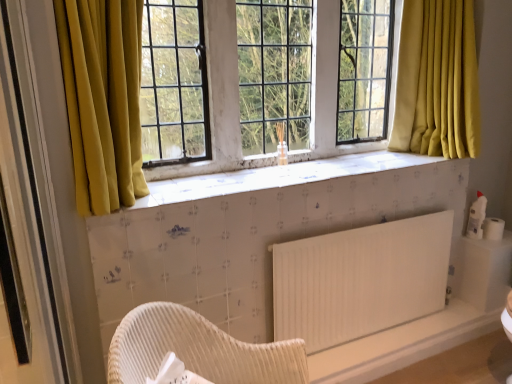
Question: Does white matte toilet paper at right contain white matte radiator at lower right?

Choices:
 (A) yes
 (B) no

Answer: (B)

Question: Does white matte toilet paper at right have a greater height compared to white matte radiator at lower right?

Choices:
 (A) yes
 (B) no

Answer: (B)

Question: Does white matte toilet paper at right appear on the right side of white matte radiator at lower right?

Choices:
 (A) yes
 (B) no

Answer: (A)

Question: Does white matte toilet paper at right turn towards white matte radiator at lower right?

Choices:
 (A) no
 (B) yes

Answer: (A)

Question: Is white matte toilet paper at right not inside white matte radiator at lower right?

Choices:
 (A) yes
 (B) no

Answer: (A)

Question: In terms of size, does white matte radiator at lower right appear bigger or smaller than woven wood chair at lower center?

Choices:
 (A) small
 (B) big

Answer: (A)

Question: Visually, is white matte radiator at lower right positioned to the left or to the right of woven wood chair at lower center?

Choices:
 (A) left
 (B) right

Answer: (B)

Question: In terms of width, does white matte radiator at lower right look wider or thinner when compared to woven wood chair at lower center?

Choices:
 (A) wide
 (B) thin

Answer: (B)

Question: In the image, is white matte radiator at lower right positioned in front of or behind woven wood chair at lower center?

Choices:
 (A) front
 (B) behind

Answer: (B)

Question: Based on their sizes in the image, would you say matte glass window screen at center is bigger or smaller than white matte toilet paper at right?

Choices:
 (A) small
 (B) big

Answer: (B)

Question: From the image's perspective, is matte glass window screen at center above or below white matte toilet paper at right?

Choices:
 (A) above
 (B) below

Answer: (A)

Question: Visually, is matte glass window screen at center positioned to the left or to the right of white matte toilet paper at right?

Choices:
 (A) left
 (B) right

Answer: (A)

Question: Is matte glass window screen at center in front of or behind white matte toilet paper at right in the image?

Choices:
 (A) behind
 (B) front

Answer: (B)

Question: Looking at their shapes, would you say woven wood chair at lower center is wider or thinner than white textured tile at center?

Choices:
 (A) wide
 (B) thin

Answer: (A)

Question: From a real-world perspective, is woven wood chair at lower center physically located above or below white textured tile at center?

Choices:
 (A) above
 (B) below

Answer: (B)